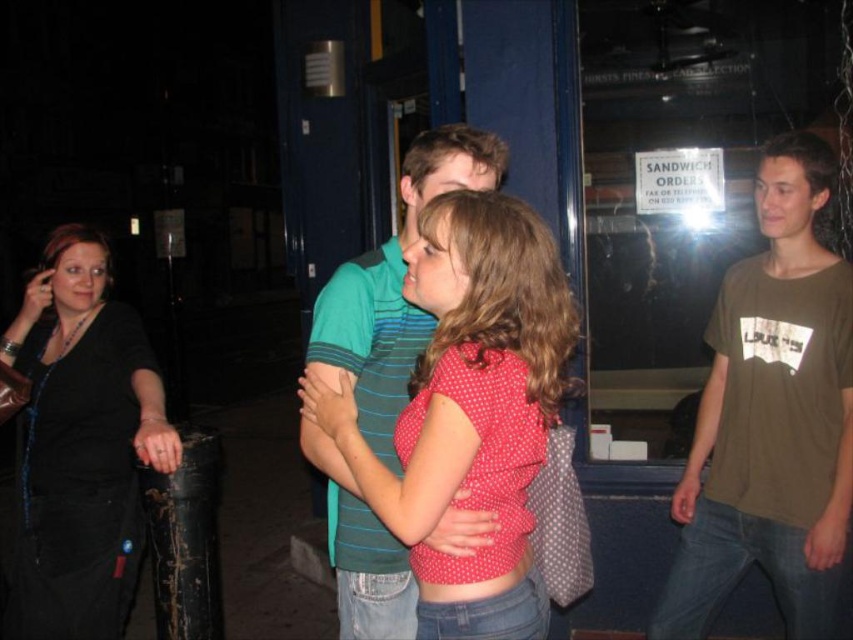
Based on the photo, you are a fashion designer observing the group of four individuals in the nighttime scene. You need to determine which clothing item is shorter between the polka dot fabric shirt at center and the black leather jacket at left. Which one should you choose?

The polka dot fabric shirt at center is shorter than the black leather jacket at left, so you should choose the polka dot fabric shirt at center as the shorter clothing item.